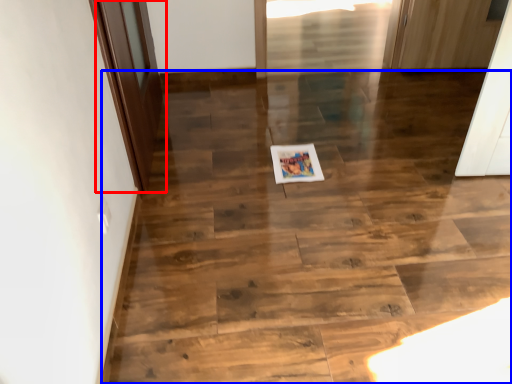
Question: Among these objects, which one is farthest to the camera, door (highlighted by a red box) or stairwell (highlighted by a blue box)?

Choices:
 (A) door
 (B) stairwell

Answer: (A)